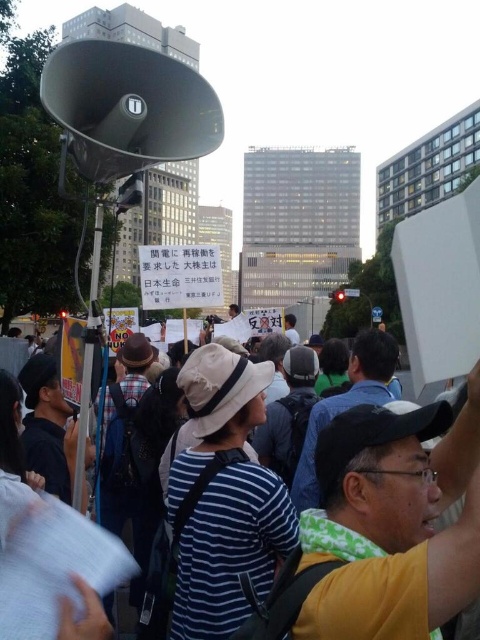
Which of these two, striped fabric crowd at lower center or matte gray megaphone at upper left, stands taller?

With more height is striped fabric crowd at lower center.

Measure the distance from striped fabric crowd at lower center to matte gray megaphone at upper left.

21.42 meters

Is point (231, 432) closer to camera compared to point (84, 166)?

No, (231, 432) is further to viewer.

Locate an element on the screen. The height and width of the screenshot is (640, 480). striped fabric crowd at lower center is located at coordinates (463, 515).